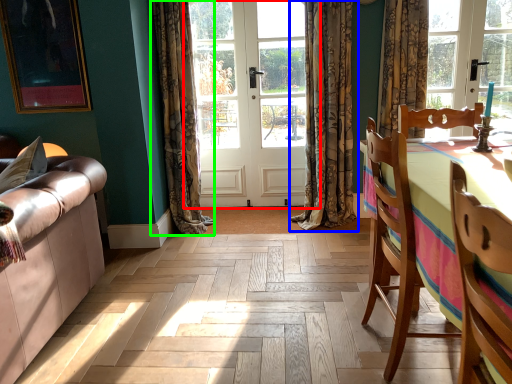
Question: Based on their relative distances, which object is nearer to door (highlighted by a red box)? Choose from curtain (highlighted by a blue box) and curtain (highlighted by a green box).

Choices:
 (A) curtain
 (B) curtain

Answer: (A)